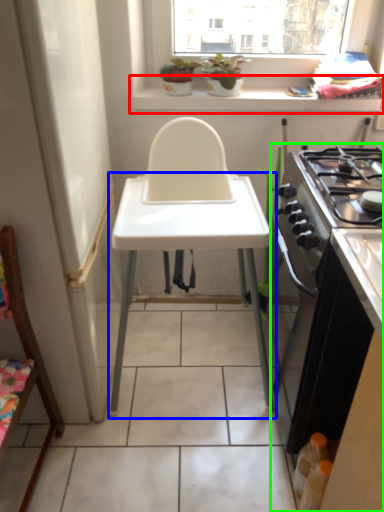
Question: Which object is the closest to the window sill (highlighted by a red box)? Choose among these: changing table (highlighted by a blue box) or cabinetry (highlighted by a green box).

Choices:
 (A) changing table
 (B) cabinetry

Answer: (A)